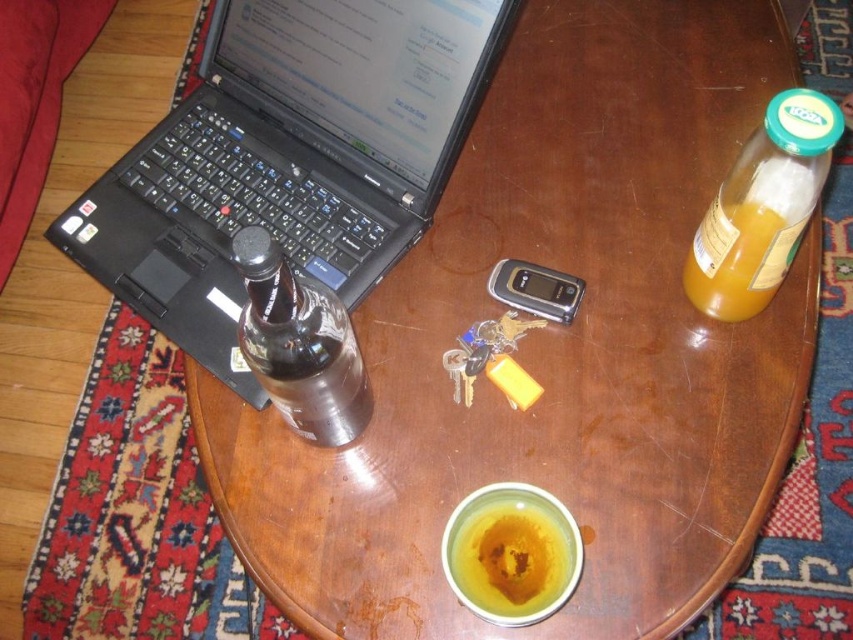
Question: Is black plastic laptop at left positioned behind yellow matte cup at center?

Choices:
 (A) yes
 (B) no

Answer: (A)

Question: Which object is farther from the camera taking this photo?

Choices:
 (A) yellow matte cup at center
 (B) translucent plastic bottle at upper right

Answer: (A)

Question: Which point is farther from the camera taking this photo?

Choices:
 (A) (524, 524)
 (B) (119, 166)

Answer: (B)

Question: Where is transparent glass bottle at left located in relation to yellow matte cup at center in the image?

Choices:
 (A) above
 (B) below

Answer: (A)

Question: Does translucent plastic bottle at upper right come in front of yellow matte cup at center?

Choices:
 (A) yes
 (B) no

Answer: (A)

Question: Which is nearer to the black plastic laptop at left?

Choices:
 (A) yellow matte cup at center
 (B) translucent plastic bottle at upper right
 (C) transparent glass bottle at left

Answer: (C)